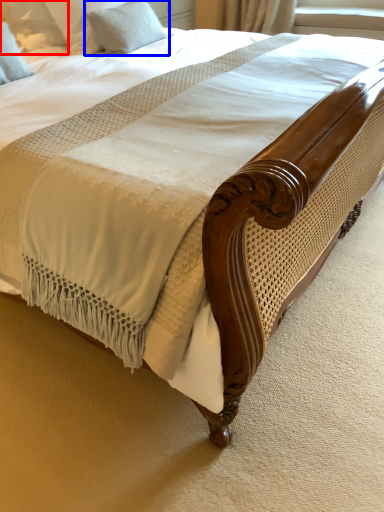
Question: Which object is closer to the camera taking this photo, pillow (highlighted by a red box) or pillow (highlighted by a blue box)?

Choices:
 (A) pillow
 (B) pillow

Answer: (A)